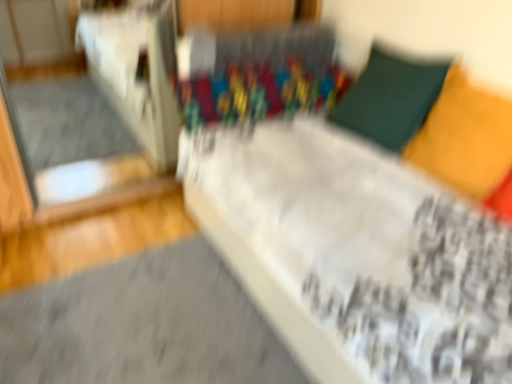
Question: Looking at the image, does transparent glass door at left seem bigger or smaller compared to velvet green pillow at upper right, the second pillow from the front?

Choices:
 (A) big
 (B) small

Answer: (A)

Question: From the image's perspective, is transparent glass door at left above or below velvet green pillow at upper right, the second pillow from the front?

Choices:
 (A) above
 (B) below

Answer: (A)

Question: Based on their relative distances, which object is farther from the matte yellow pillow at upper right, which is the 2th pillow in back-to-front order?

Choices:
 (A) velvet green pillow at upper right, the second pillow from the front
 (B) transparent glass door at left

Answer: (B)

Question: Which object is the closest to the transparent glass door at left?

Choices:
 (A) matte yellow pillow at upper right, arranged as the 1th pillow when viewed from the front
 (B) velvet green pillow at upper right, the second pillow from the front

Answer: (B)